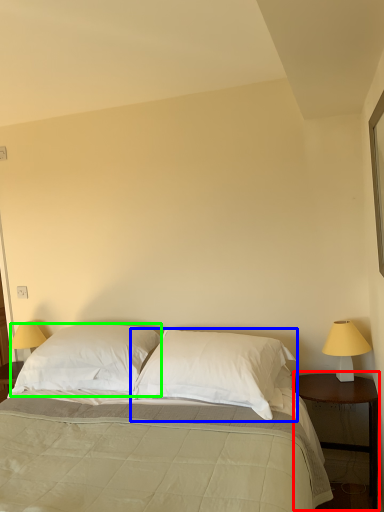
Question: Estimate the real-world distances between objects in this image. Which object is closer to nightstand (highlighted by a red box), pillow (highlighted by a blue box) or pillow (highlighted by a green box)?

Choices:
 (A) pillow
 (B) pillow

Answer: (A)